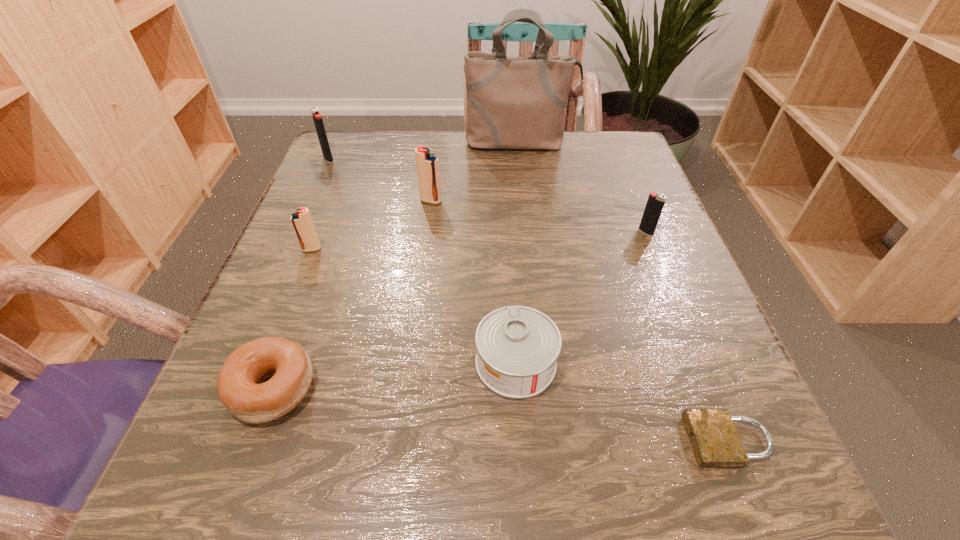
Find the location of a particular element. silver can is located at coordinates (517, 346).

Identify the location of bagel. (241, 388).

This screenshot has height=540, width=960. What are the coordinates of `the shortest object` in the screenshot? It's located at (715, 441).

This screenshot has height=540, width=960. I want to click on vacant area situated 0.060m on the front-facing side of the tallest object, so click(522, 170).

This screenshot has width=960, height=540. Identify the location of free space located 0.050m on the back of the farthest igniter. (335, 144).

Identify the location of free point located 0.180m on the front of the fourth object from left to right. The image size is (960, 540). (422, 269).

I want to click on free space located 0.230m on the front of the left red igniter, so click(268, 363).

I want to click on free region located 0.130m on the left of the rightmost igniter, so click(x=570, y=232).

At what (x,y) coordinates should I click in order to perform the action: click on vacant space located on the back of the can. Please return your answer as a coordinate pair (x, y). The image size is (960, 540). Looking at the image, I should click on (507, 228).

Locate an element on the screen. blank area located on the right of the bagel is located at coordinates (484, 387).